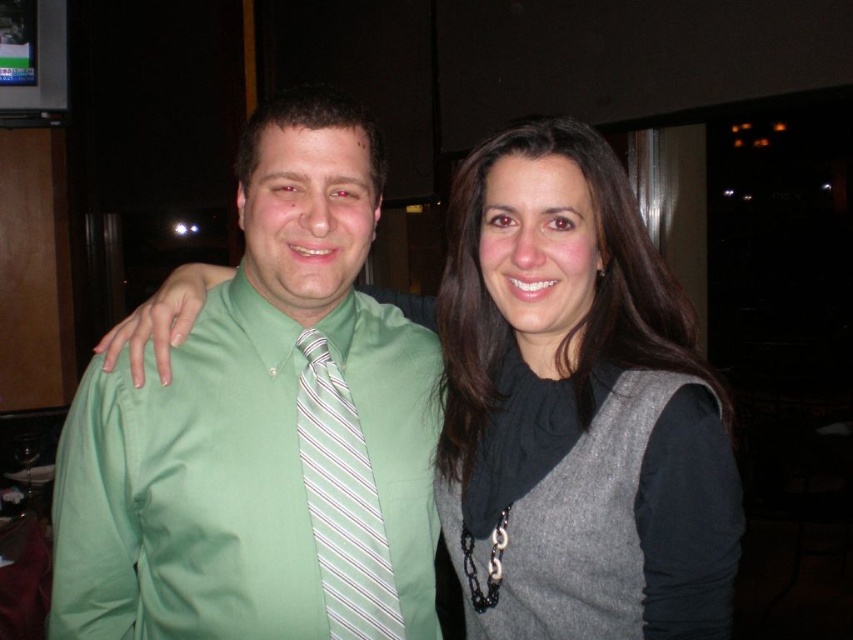
Question: Can you confirm if gray wool vest at right is positioned to the right of white striped tie at center?

Choices:
 (A) no
 (B) yes

Answer: (B)

Question: Does green smooth shirt at center appear under white striped tie at center?

Choices:
 (A) no
 (B) yes

Answer: (A)

Question: Which of the following is the closest to the observer?

Choices:
 (A) (376, 552)
 (B) (276, 483)

Answer: (B)

Question: Which of the following is the closest to the observer?

Choices:
 (A) (306, 378)
 (B) (498, 552)

Answer: (B)

Question: Is green smooth shirt at center smaller than white striped tie at center?

Choices:
 (A) no
 (B) yes

Answer: (A)

Question: Estimate the real-world distances between objects in this image. Which object is farther from the green smooth shirt at center?

Choices:
 (A) white striped tie at center
 (B) gray wool vest at right

Answer: (B)